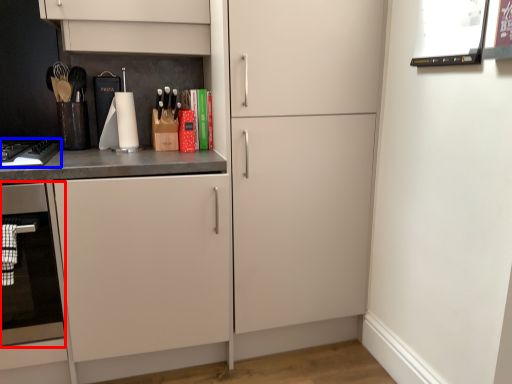
Question: Among these objects, which one is farthest to the camera, oven (highlighted by a red box) or home appliance (highlighted by a blue box)?

Choices:
 (A) oven
 (B) home appliance

Answer: (B)